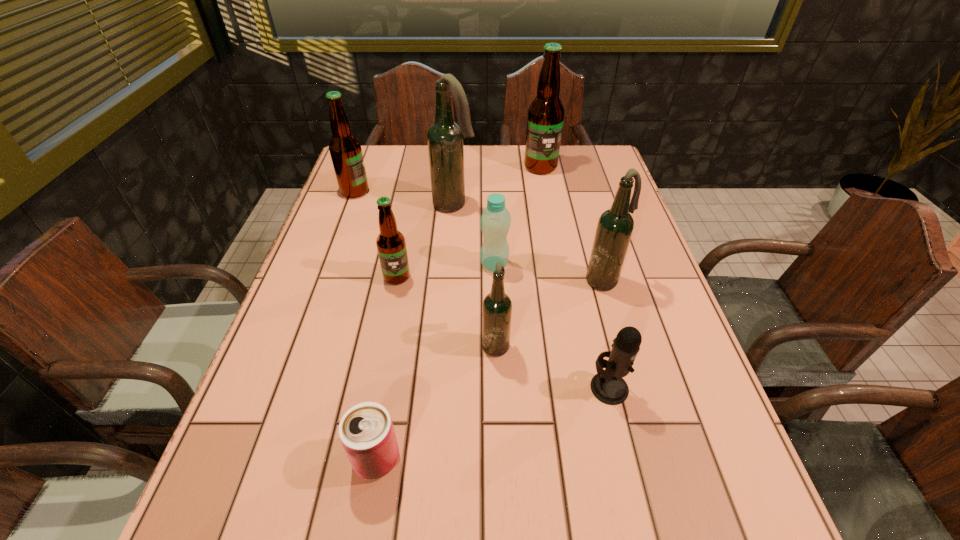
At what (x,y) coordinates should I click in order to perform the action: click on the third nearest object. Please return your answer as a coordinate pair (x, y). Looking at the image, I should click on (497, 307).

The height and width of the screenshot is (540, 960). I want to click on the second dark beer bottle from right to left, so click(x=497, y=307).

At what (x,y) coordinates should I click in order to perform the action: click on bottle. Please return your answer as a coordinate pair (x, y). This screenshot has width=960, height=540. Looking at the image, I should click on 495,221.

Where is `the second nearest object`? This screenshot has height=540, width=960. the second nearest object is located at coordinates (608, 386).

You are a GUI agent. You are given a task and a screenshot of the screen. Output one action in this format:
    pyautogui.click(x=<x>, y=<y>)
    Task: Click on the black microphone
    This screenshot has height=540, width=960.
    Given the screenshot: What is the action you would take?
    point(608,386)

Locate an element on the screen. the nearest object is located at coordinates (366, 431).

Locate an element on the screen. The width and height of the screenshot is (960, 540). can is located at coordinates (366, 431).

Image resolution: width=960 pixels, height=540 pixels. In order to click on free space located on the label of the farthest object in this screenshot , I will do `click(544, 188)`.

I want to click on free region located 0.290m on the front of the third beer bottle from left to right, so click(448, 286).

You are a GUI agent. You are given a task and a screenshot of the screen. Output one action in this format:
    pyautogui.click(x=<x>, y=<y>)
    Task: Click on the free space located 0.110m on the left of the second smallest dark beer bottle
    
    Given the screenshot: What is the action you would take?
    pyautogui.click(x=540, y=280)